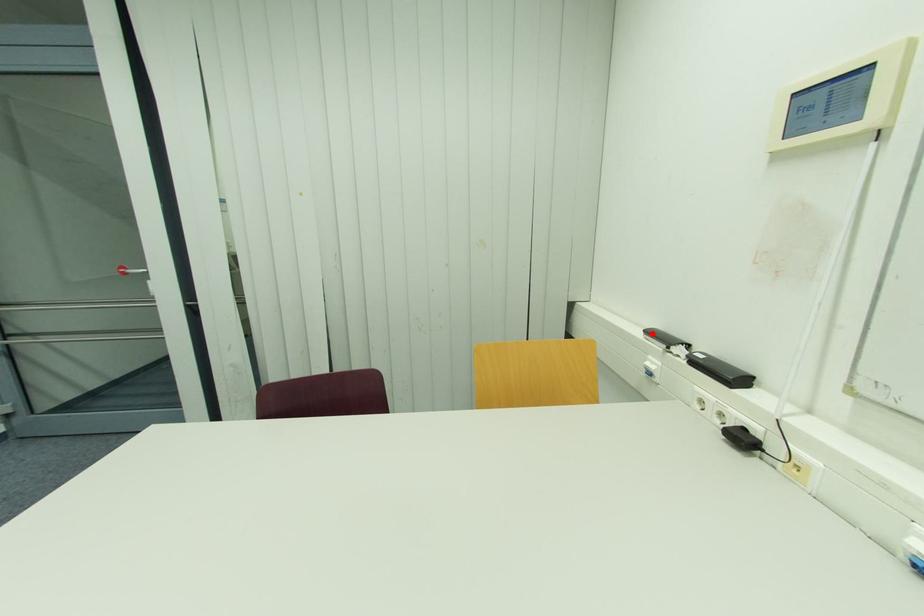
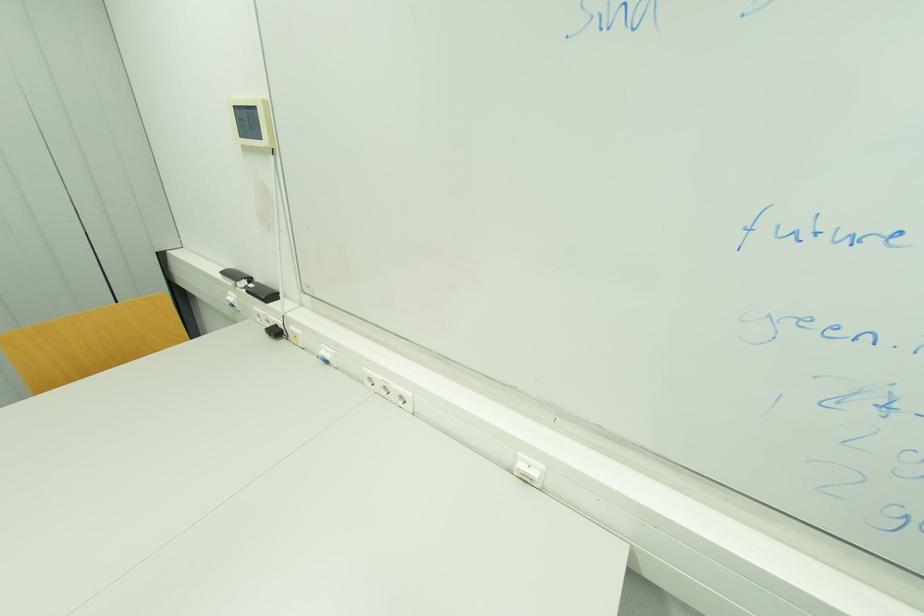
The point at the highlighted location is marked in the first image. Where is the corresponding point in the second image?

(228, 274)